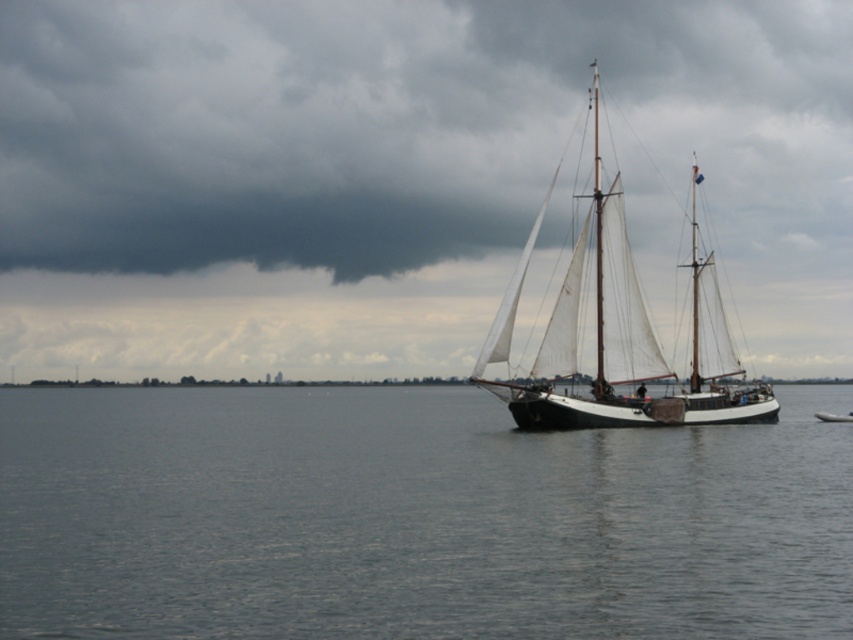
You are a sailor on the schooner anchored near the center of the image. You need to navigate to a specific location marked at coordinates point 0.811, 0.485. According to the image, where is the gray water at center located in relation to your current position?

The gray water at center is located at point (x=413, y=518), so it is exactly at the coordinates you need to navigate to.

You are a sailor on the white canvas sailboat at center and you want to avoid getting caught in the dark gray cloud at upper center. Which direction should you sail to move away from the cloud?

The dark gray cloud at upper center is smaller than the white canvas sailboat at center, so the cloud is closer to you. To move away from it, you should sail downward away from the upper center direction.

You are a sailor on the schooner anchored near the center right of the image. You notice a dark gray cloud at upper center located at point (x=396, y=125). Based on the coordinates, is the cloud positioned to the left or right of the ship?

The dark gray cloud at upper center located at point (x=396, y=125) is positioned to the left of the ship.